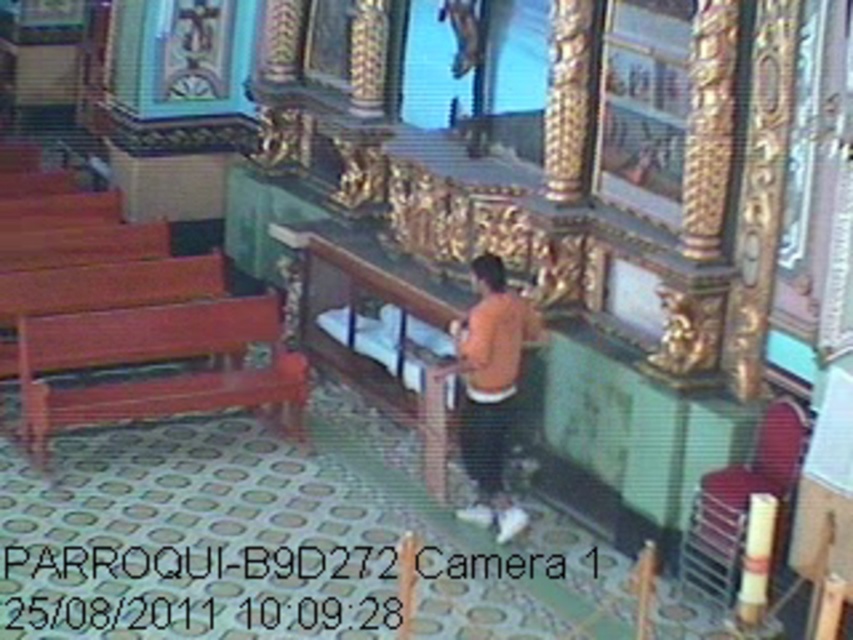
Is point (293, 358) positioned before point (508, 394)?

No, it is behind (508, 394).

Which is in front, point (27, 429) or point (490, 284)?

Point (490, 284)

Find the location of a particular element. The image size is (853, 640). wooden polished bench at left is located at coordinates (154, 362).